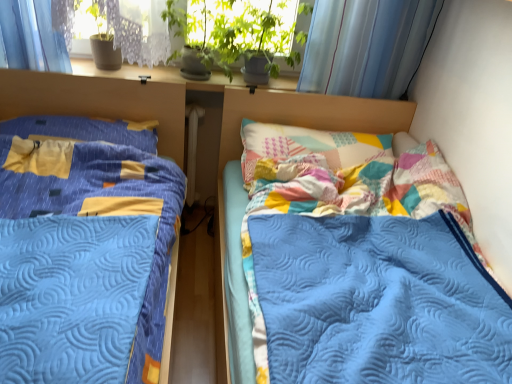
Question: From the image's perspective, is yellow fabric pillow at left positioned above or below blue quilted bed at left, which is counted as the 2th bed, starting from the right?

Choices:
 (A) below
 (B) above

Answer: (B)

Question: Is yellow fabric pillow at left in front of or behind blue quilted bed at left, which is counted as the 2th bed, starting from the right, in the image?

Choices:
 (A) behind
 (B) front

Answer: (A)

Question: Based on their relative distances, which object is nearer to the yellow fabric pillow at left?

Choices:
 (A) blue quilted bed at left, which is counted as the 2th bed, starting from the right
 (B) white plastic radiator at center
 (C) quilted blue blanket at center, arranged as the second bed when viewed from the left

Answer: (A)

Question: Considering the real-world distances, which object is closest to the quilted blue blanket at center, arranged as the second bed when viewed from the left?

Choices:
 (A) white plastic radiator at center
 (B) blue quilted bed at left, acting as the first bed starting from the left
 (C) yellow fabric pillow at left

Answer: (A)